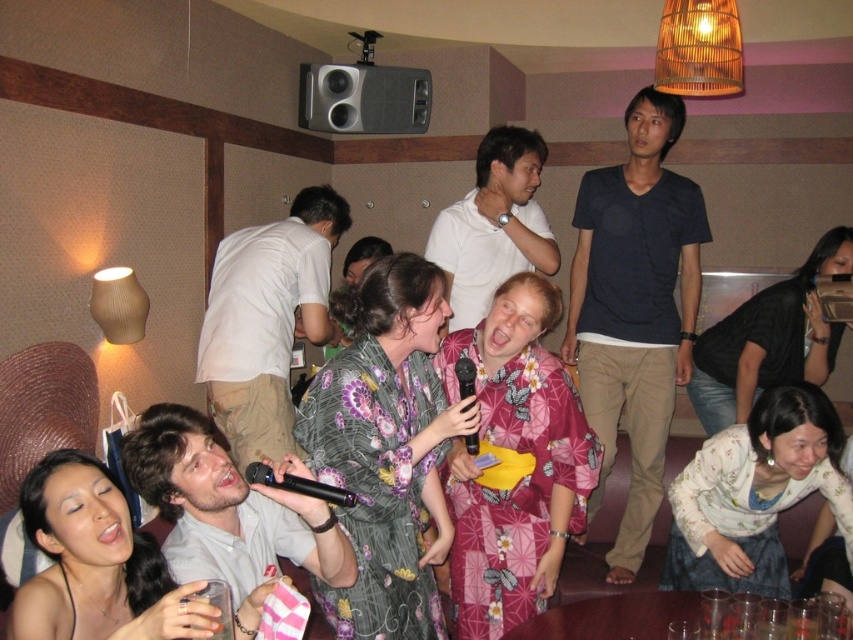
Question: Does dark blue cotton t-shirt at upper center appear under black plastic microphone at center?

Choices:
 (A) yes
 (B) no

Answer: (B)

Question: Is dark blue cotton t-shirt at upper center thinner than white cotton shirt at center?

Choices:
 (A) no
 (B) yes

Answer: (B)

Question: Can you confirm if dark blue cotton t-shirt at upper center is positioned to the left of light gray shirt at center?

Choices:
 (A) no
 (B) yes

Answer: (A)

Question: Which object is farther from the camera taking this photo?

Choices:
 (A) matte gray speaker at upper center
 (B) dark blue cotton t-shirt at upper center

Answer: (A)

Question: Which point is farther to the camera?

Choices:
 (A) dark blue cotton t-shirt at upper center
 (B) white cotton shirt at center
 (C) black plastic microphone at center

Answer: (A)

Question: Among these points, which one is nearest to the camera?

Choices:
 (A) (532, 132)
 (B) (474, 433)

Answer: (B)